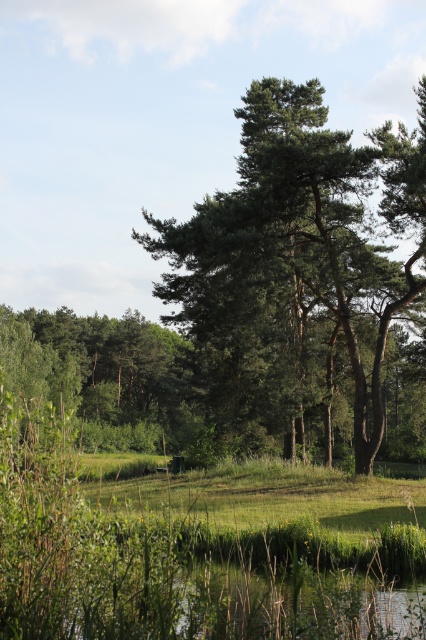
Between green leafy tree at center and green leafy tree at left, which one has more height?

green leafy tree at center

Does point (268, 179) lie behind point (195, 410)?

No, (268, 179) is closer to viewer.

Where is `green leafy tree at center`? green leafy tree at center is located at coordinates (299, 262).